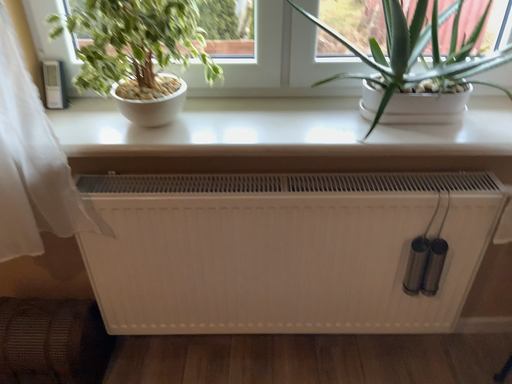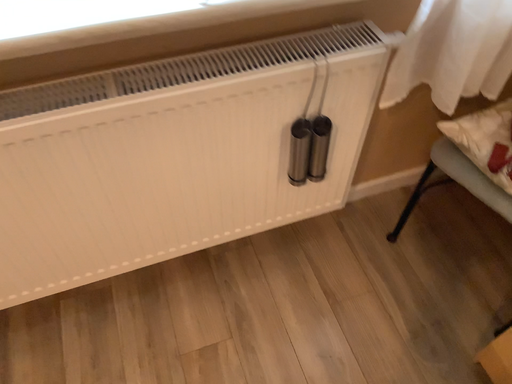
Question: How did the camera likely rotate when shooting the video?

Choices:
 (A) rotated right
 (B) rotated left

Answer: (A)